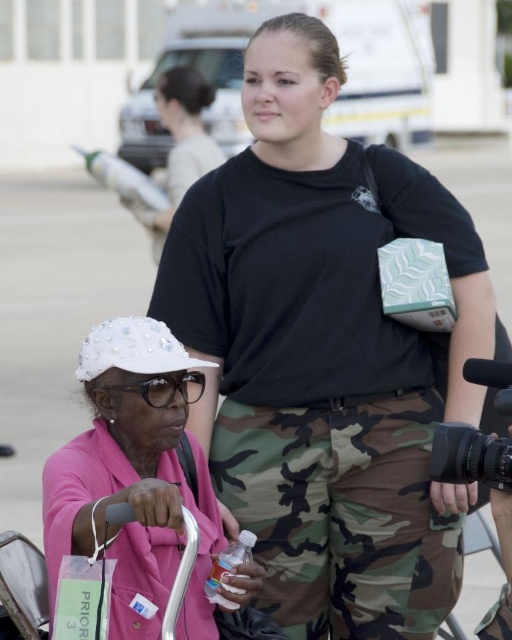
Question: Can you confirm if white pearl hat at lower left is positioned below translucent plastic bottle at lower center?

Choices:
 (A) no
 (B) yes

Answer: (A)

Question: Which is nearer to the matte black shirt at upper center?

Choices:
 (A) translucent plastic bottle at lower center
 (B) camo pants at center

Answer: (B)

Question: Which object is farther from the camera taking this photo?

Choices:
 (A) white pearl hat at lower left
 (B) translucent plastic bottle at lower center
 (C) black plastic video camera at center right

Answer: (B)

Question: Can you confirm if camo pants at center is positioned to the right of translucent plastic bottle at lower center?

Choices:
 (A) yes
 (B) no

Answer: (A)

Question: Is white pearl hat at lower left above translucent plastic bottle at lower center?

Choices:
 (A) no
 (B) yes

Answer: (B)

Question: Which point is closer to the camera?

Choices:
 (A) (330, 556)
 (B) (404, 394)
 (C) (442, 426)

Answer: (C)